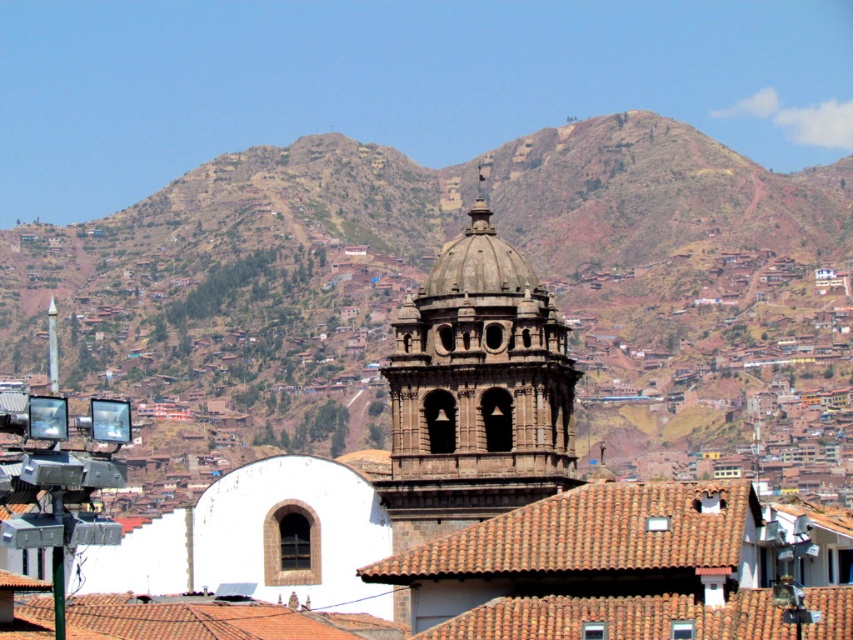
How distant is brown rocky mountain at upper center from dark brown stone tower at center?

152.29 feet

What do you see at coordinates (422, 275) in the screenshot?
I see `brown rocky mountain at upper center` at bounding box center [422, 275].

Identify the location of brown rocky mountain at upper center. 422,275.